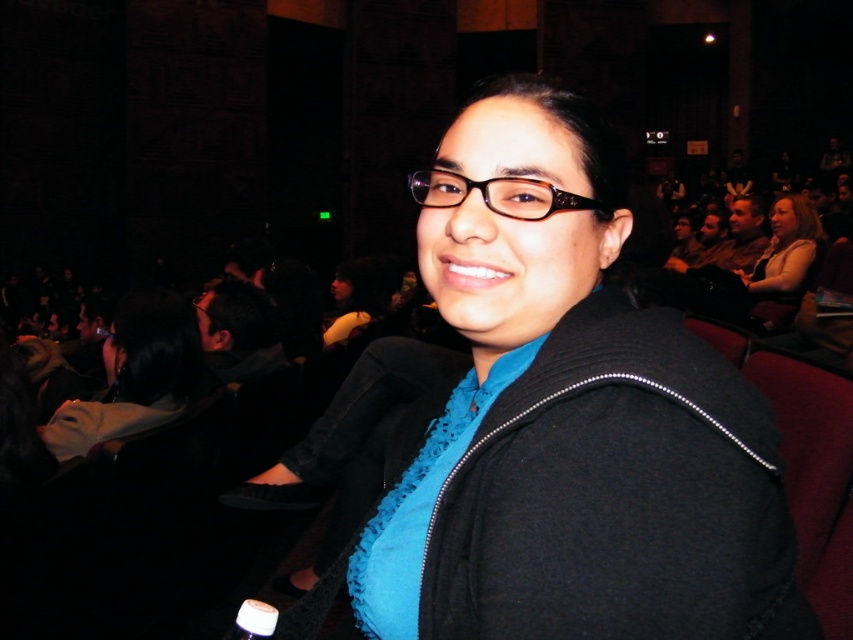
Who is positioned more to the right, matte black jacket at center or black fabric jacket at center?

Positioned to the right is matte black jacket at center.

Who is more forward, (x=614, y=492) or (x=100, y=400)?

Point (x=614, y=492) is in front.

Is point (549, 266) positioned in front of point (190, 356)?

Yes, it is in front of point (190, 356).

Image resolution: width=853 pixels, height=640 pixels. I want to click on matte black jacket at center, so click(570, 428).

Between black fabric jacket at center and brown textured glasses at center, which one appears on the right side from the viewer's perspective?

brown textured glasses at center is more to the right.

Can you confirm if black fabric jacket at center is positioned below brown textured glasses at center?

Indeed, black fabric jacket at center is positioned under brown textured glasses at center.

Between point (79, 436) and point (596, 209), which one is positioned in front?

Point (596, 209)

The height and width of the screenshot is (640, 853). Find the location of `black fabric jacket at center`. black fabric jacket at center is located at coordinates (132, 376).

Find the location of a particular element. matte black jacket at center is located at coordinates (570, 428).

Between matte black jacket at center and brown textured glasses at center, which one appears on the right side from the viewer's perspective?

matte black jacket at center

Identify the location of matte black jacket at center. The height and width of the screenshot is (640, 853). coord(570,428).

The image size is (853, 640). Identify the location of matte black jacket at center. 570,428.